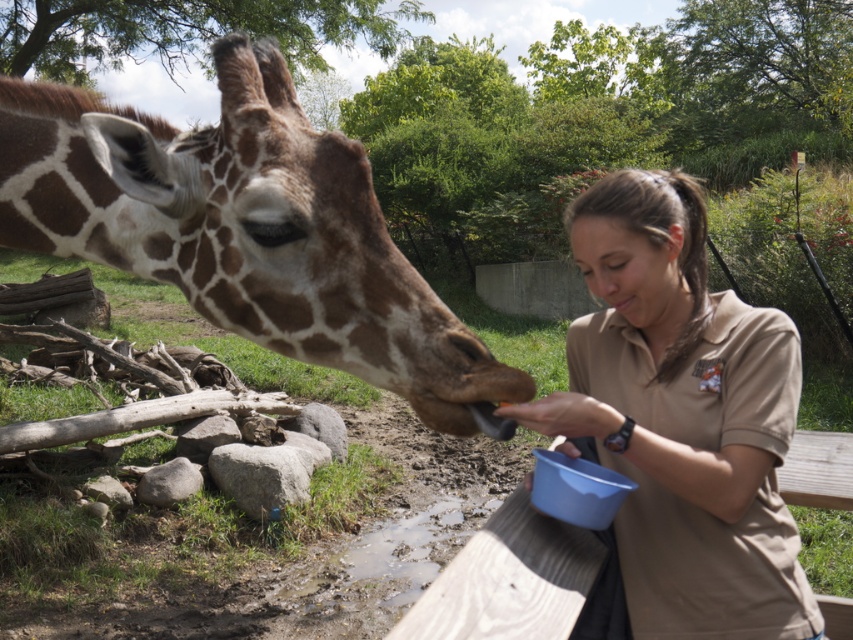
You are a zoo visitor observing the giraffe and the zookeeper. Based on the scene, which object is wider, the brown spotted skin at center or the brown uniform at center?

The brown spotted skin at center might be wider than brown uniform at center according to the description.

You are standing in front of the giraffe and want to touch its brown spotted skin at center. Where should you reach to find it?

The brown spotted skin at center is located at point (247,228), so you should reach towards that coordinate to touch it.

You are a zookeeper observing the giraffe and the person feeding it. Which object has a smaller size between the brown spotted skin at center and the brown uniform at center?

The brown spotted skin at center has a smaller size compared to the brown uniform at center.